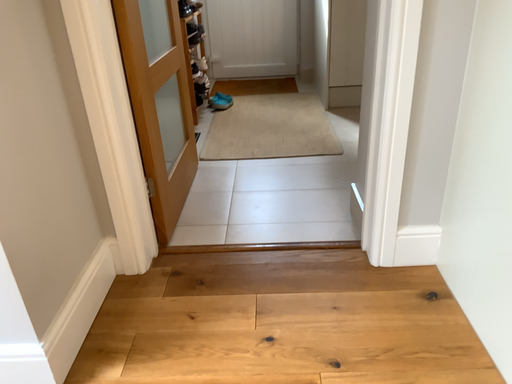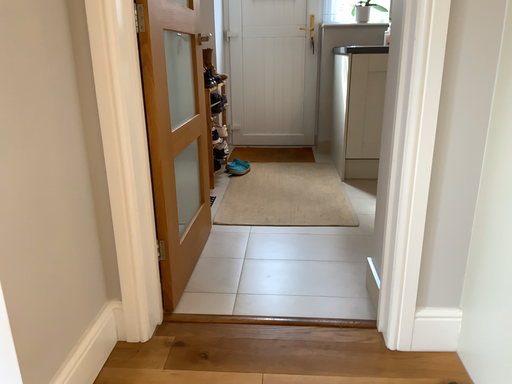
Question: How did the camera likely rotate when shooting the video?

Choices:
 (A) rotated downward
 (B) rotated upward

Answer: (B)